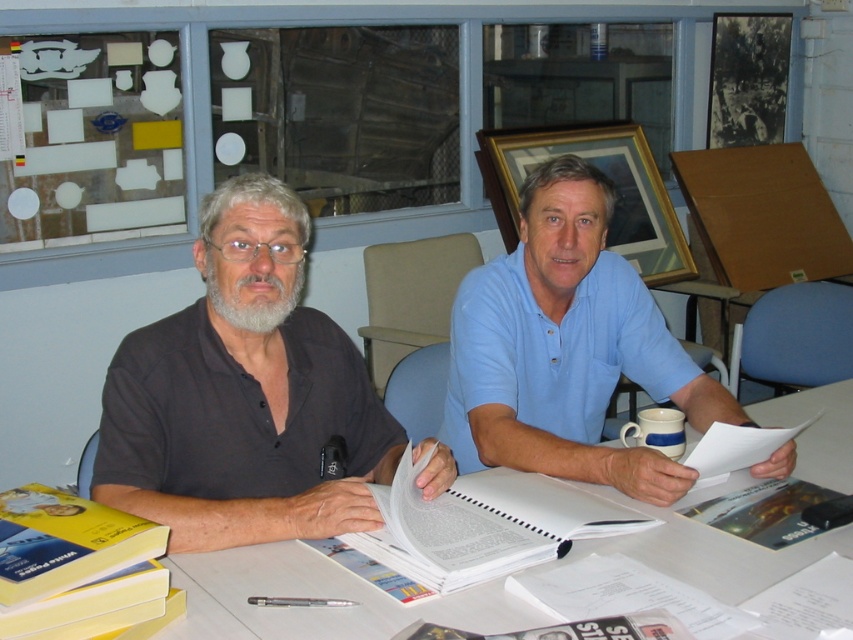
Question: Which object is closer to the camera taking this photo?

Choices:
 (A) white paper book at center
 (B) white paper at right
 (C) white paper at center
 (D) light blue polo shirt at center

Answer: (C)

Question: Which object is farther from the camera taking this photo?

Choices:
 (A) light blue polo shirt at center
 (B) white paper book at center

Answer: (A)

Question: Is dark gray shirt at center below light blue polo shirt at center?

Choices:
 (A) no
 (B) yes

Answer: (B)

Question: Does white paper at center appear over matte plastic book at center?

Choices:
 (A) yes
 (B) no

Answer: (A)

Question: Which point is closer to the camera taking this photo?

Choices:
 (A) (409, 452)
 (B) (274, 336)
 (C) (515, 392)

Answer: (A)

Question: Observing the image, what is the correct spatial positioning of dark gray shirt at left in reference to light blue polo shirt at center?

Choices:
 (A) below
 (B) above

Answer: (A)